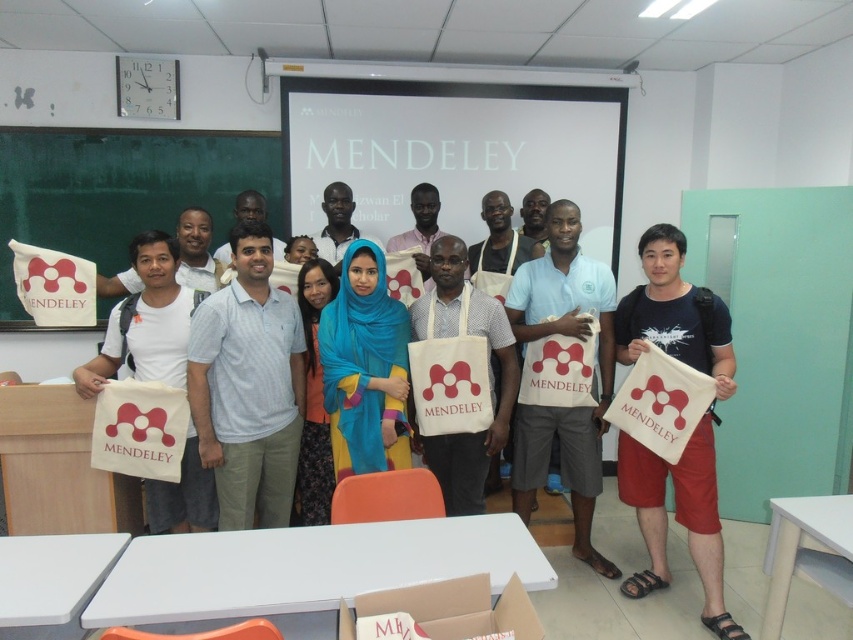
Question: Which of these objects is positioned closest to the white canvas bag at center?

Choices:
 (A) green chalkboard at left
 (B) matte white bag at center

Answer: (B)

Question: Considering the relative positions of white canvas bag at center and matte white bag at center in the image provided, where is white canvas bag at center located with respect to matte white bag at center?

Choices:
 (A) right
 (B) left

Answer: (A)

Question: Can you confirm if green chalkboard at left is positioned to the left of matte white bag at center?

Choices:
 (A) yes
 (B) no

Answer: (A)

Question: Which point is farther to the camera?

Choices:
 (A) green chalkboard at left
 (B) white canvas bag at center

Answer: (A)

Question: Is the position of green chalkboard at left less distant than that of white canvas bag at center?

Choices:
 (A) yes
 (B) no

Answer: (B)

Question: Estimate the real-world distances between objects in this image. Which object is closer to the matte white bag at center?

Choices:
 (A) white canvas bag at center
 (B) green chalkboard at left

Answer: (A)